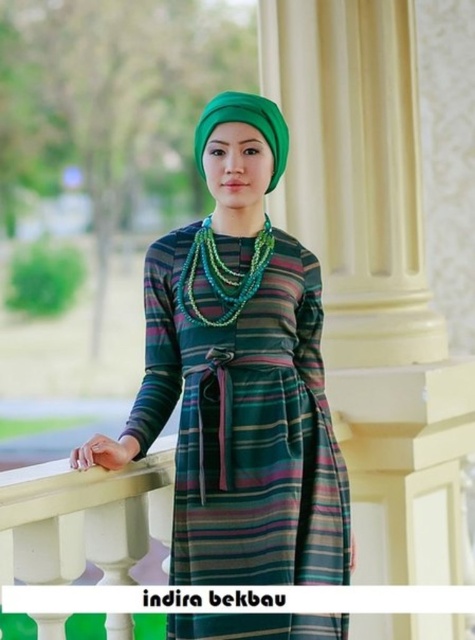
You are a fashion designer analyzing the image. The striped fabric dress at center is represented by point (246, 426). Can you determine the vertical position of the striped fabric dress at center relative to the cream column on the right?

A: The striped fabric dress at center is represented by point (246, 426), which is below the cream column on the right.

You are a fashion designer observing the striped fabric dress at center and the green beaded necklace at center. Which clothing item is taller?

The striped fabric dress at center has a greater height compared to the green beaded necklace at center, so the striped fabric dress at center is taller.

You are a fashion designer observing the striped fabric dress at center and the white painted wood at center in the scene. Which object is positioned to the left of the other?

The striped fabric dress at center is to the left of the white painted wood at center.